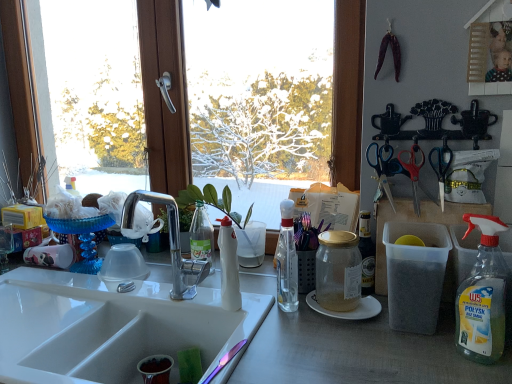
This screenshot has height=384, width=512. Identify the location of vacant region to the left of gold glass jar at center, acting as the third bottle starting from the left. (269, 312).